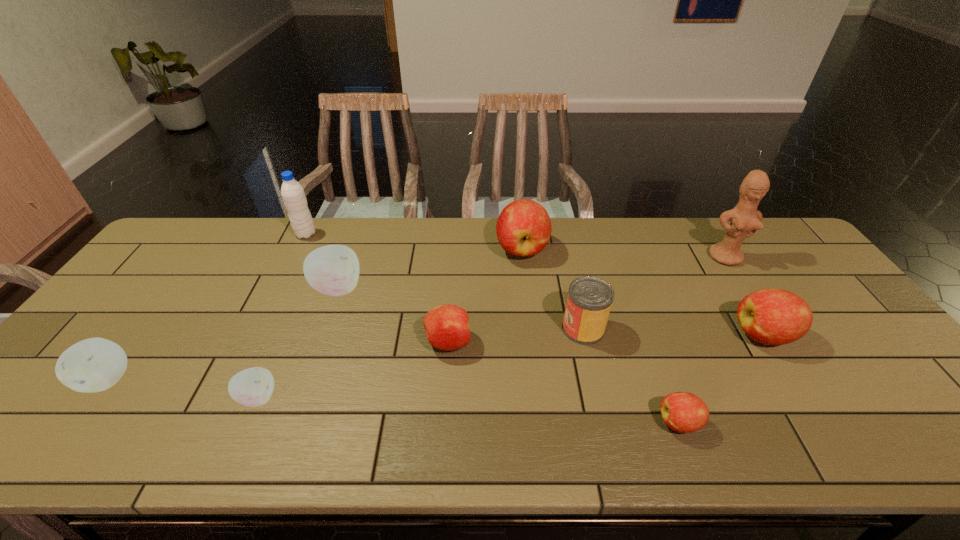
Image resolution: width=960 pixels, height=540 pixels. I want to click on object that is at the near edge, so click(x=683, y=412).

Locate an element on the screen. object that is at the left edge is located at coordinates (92, 365).

Find the location of a particular element. Image resolution: width=960 pixels, height=540 pixels. vacant space at the far edge is located at coordinates (230, 246).

Identify the location of vacant space at the near edge. (247, 439).

This screenshot has width=960, height=540. I want to click on blank area at the left edge, so click(x=170, y=297).

This screenshot has width=960, height=540. I want to click on free location at the right edge of the desktop, so (x=911, y=409).

Image resolution: width=960 pixels, height=540 pixels. I want to click on free area in between the tallest object and the second smallest white apple, so click(418, 318).

The width and height of the screenshot is (960, 540). What are the coordinates of `vacant area that lies between the second red apple from right to left and the tallest object` in the screenshot? It's located at (703, 340).

Image resolution: width=960 pixels, height=540 pixels. Identify the location of free spot between the smallest white apple and the water bottle. (282, 316).

The image size is (960, 540). Find the location of `empty space that is in between the leftmost red apple and the fifth apple from left to right`. empty space that is in between the leftmost red apple and the fifth apple from left to right is located at coordinates (485, 295).